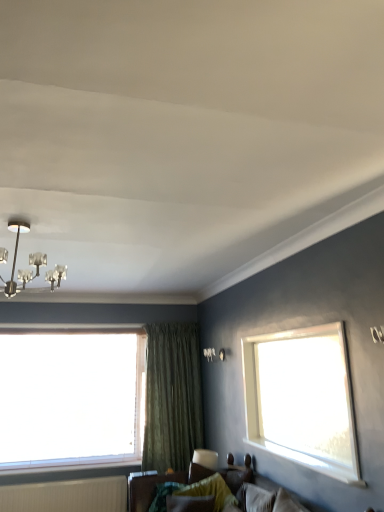
Question: Is metallic chandelier at upper left completely or partially inside velvet green pillow at lower center?

Choices:
 (A) no
 (B) yes

Answer: (A)

Question: Considering the relative sizes of velvet green pillow at lower center and metallic chandelier at upper left in the image provided, is velvet green pillow at lower center bigger than metallic chandelier at upper left?

Choices:
 (A) no
 (B) yes

Answer: (A)

Question: From a real-world perspective, does velvet green pillow at lower center stand above metallic chandelier at upper left?

Choices:
 (A) yes
 (B) no

Answer: (B)

Question: Is velvet green pillow at lower center in contact with metallic chandelier at upper left?

Choices:
 (A) no
 (B) yes

Answer: (A)

Question: Is velvet green pillow at lower center not close to metallic chandelier at upper left?

Choices:
 (A) yes
 (B) no

Answer: (A)

Question: Considering the positions of metallic chandelier at upper left and white ribbed radiator at lower left in the image, is metallic chandelier at upper left bigger or smaller than white ribbed radiator at lower left?

Choices:
 (A) big
 (B) small

Answer: (A)

Question: Based on their positions, is metallic chandelier at upper left located to the left or right of white ribbed radiator at lower left?

Choices:
 (A) right
 (B) left

Answer: (A)

Question: In the image, is metallic chandelier at upper left positioned in front of or behind white ribbed radiator at lower left?

Choices:
 (A) front
 (B) behind

Answer: (A)

Question: From their relative heights in the image, would you say metallic chandelier at upper left is taller or shorter than white ribbed radiator at lower left?

Choices:
 (A) short
 (B) tall

Answer: (B)

Question: Relative to green textured curtain at center, is transparent glass window at left in front or behind?

Choices:
 (A) behind
 (B) front

Answer: (B)

Question: Choose the correct answer: Is transparent glass window at left inside green textured curtain at center or outside it?

Choices:
 (A) outside
 (B) inside

Answer: (A)

Question: Based on their sizes in the image, would you say transparent glass window at left is bigger or smaller than green textured curtain at center?

Choices:
 (A) big
 (B) small

Answer: (A)

Question: From a real-world perspective, is transparent glass window at left above or below green textured curtain at center?

Choices:
 (A) below
 (B) above

Answer: (B)

Question: Looking at their shapes, would you say velvet green pillow at lower center is wider or thinner than metallic chandelier at upper left?

Choices:
 (A) wide
 (B) thin

Answer: (B)

Question: Is point (216, 480) closer or farther from the camera than point (39, 263)?

Choices:
 (A) closer
 (B) farther

Answer: (B)